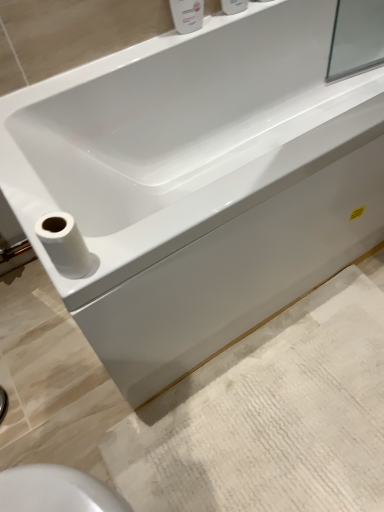
Identify the location of vacant space to the right of white matte toilet paper at lower left. (143, 238).